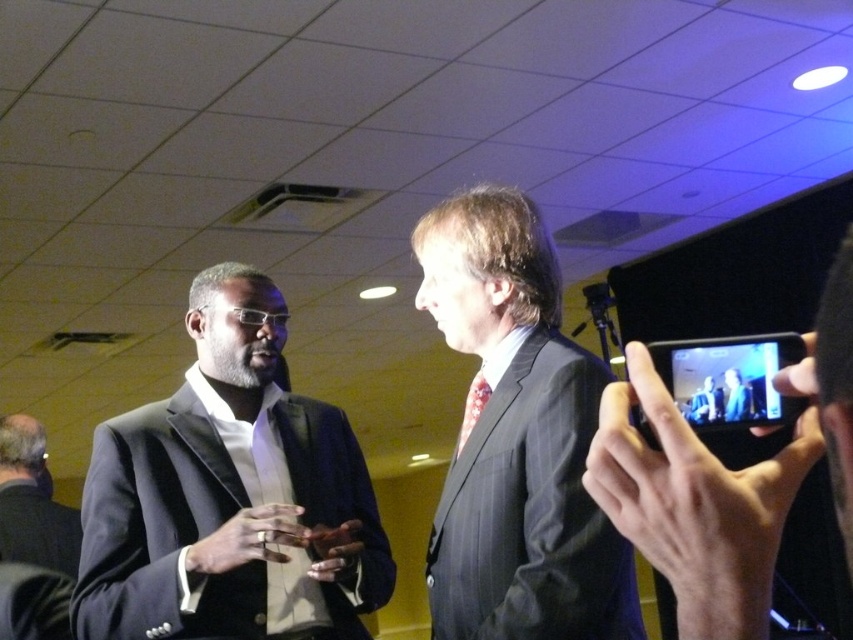
From the picture: Based on the scene description, which object is positioned to the left of the other between the matte black suit at left and the dark gray pinstripe suit at center?

The matte black suit at left is positioned to the left of the dark gray pinstripe suit at center.

You are planning to rent a suit for an event. You want to choose between the dark gray suit at lower left and the matte black suit at center. Based on the image, which one has a larger size?

The dark gray suit at lower left has a larger size than the matte black suit at center according to the description.

You are an event coordinator planning to move a 1.2 meter wide table between the dark gray suit at lower left and the matte black suit at center. Based on the scene description, can the table fit in the space between them?

The dark gray suit at lower left is below the matte black suit at center, meaning there is vertical space between them. However, the horizontal distance isn not specified, so it is uncertain if the 1.2 meter wide table can fit. Additional information about the horizontal spacing is needed to determine feasibility.